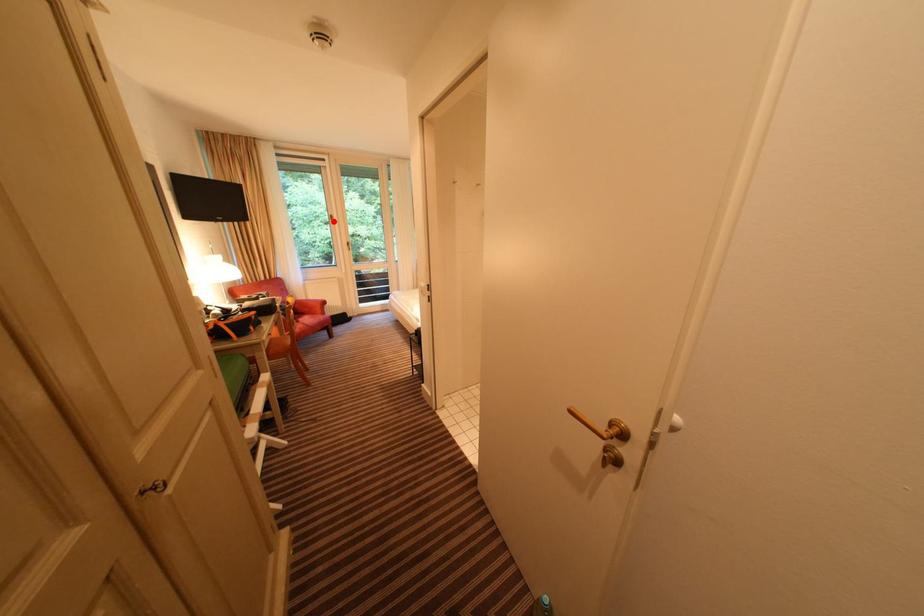
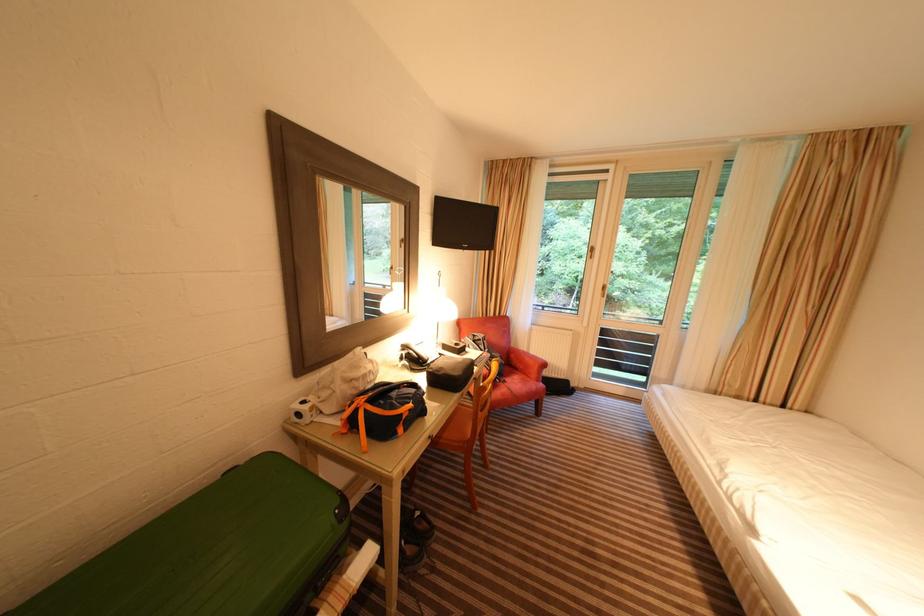
Where in the second image is the point corresponding to the highlighted location from the first image?

(590, 254)